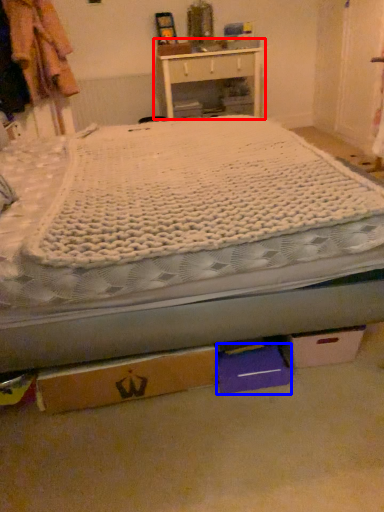
Question: Among these objects, which one is farthest to the camera, nightstand (highlighted by a red box) or storage box (highlighted by a blue box)?

Choices:
 (A) nightstand
 (B) storage box

Answer: (A)